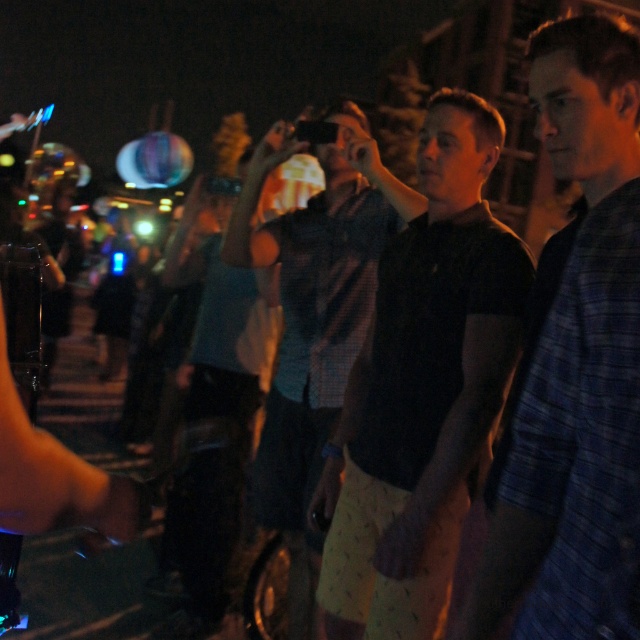
You are standing in the crowd at the nighttime event. You notice two points in the scene, one at point coordinates point (324, 468) and the other at point (216, 410). Which point is nearer to your vantage point?

Point (324, 468) is closer to the camera than point (216, 410), so the point at coordinates point (324, 468) is nearer to your vantage point.

You are at a nighttime event and see the black matte shorts at center and the dark plaid shirt at center. Which clothing item is shorter in height?

The black matte shorts at center is shorter than the dark plaid shirt at center.

You are attending a festival and want to take a photo of the blue plaid shirt at center without including the black matte shorts at center in the frame. Based on their positions, is this possible?

The black matte shorts at center is to the left of the blue plaid shirt at center, so if you position yourself to the right side of the blue plaid shirt at center and aim the camera away from the left, you can capture the blue plaid shirt at center without including the black matte shorts at center in the frame.